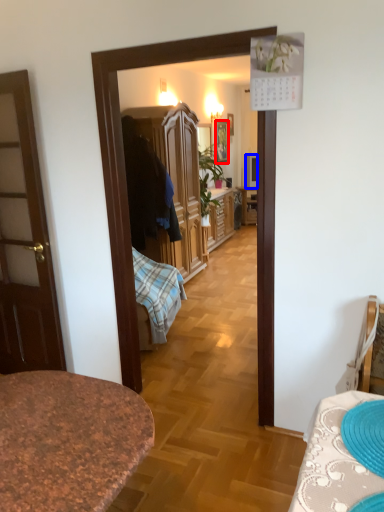
Question: Among these objects, which one is farthest to the camera, picture frame (highlighted by a red box) or television (highlighted by a blue box)?

Choices:
 (A) picture frame
 (B) television

Answer: (B)